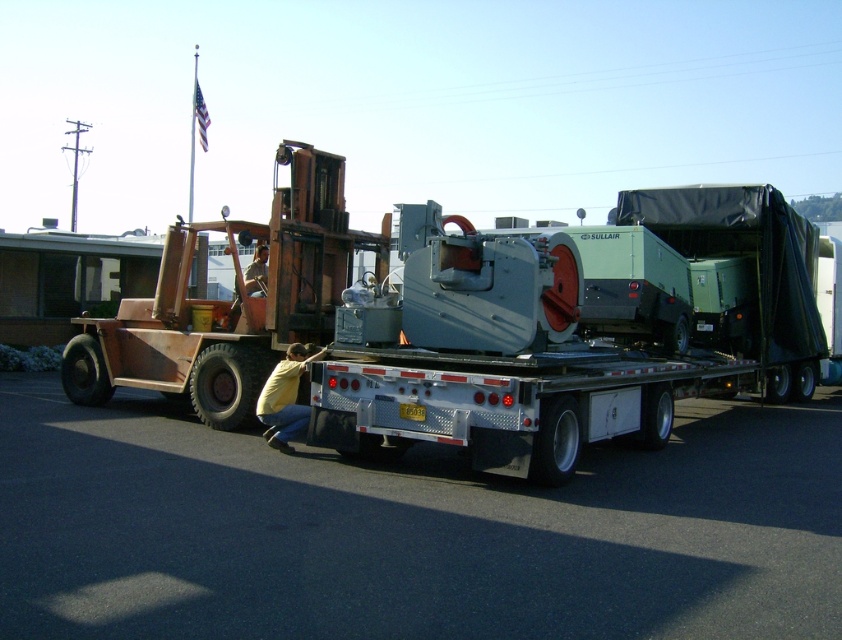
Is rusty metal forklift at center closer to the viewer compared to yellow shirt at lower center?

No, rusty metal forklift at center is behind yellow shirt at lower center.

What do you see at coordinates (228, 301) in the screenshot? I see `rusty metal forklift at center` at bounding box center [228, 301].

Image resolution: width=842 pixels, height=640 pixels. What are the coordinates of `rusty metal forklift at center` in the screenshot? It's located at (228, 301).

Can you confirm if metallic gray machinery at center is shorter than rusty metal forklift at center?

Indeed, metallic gray machinery at center has a lesser height compared to rusty metal forklift at center.

What do you see at coordinates (568, 333) in the screenshot? I see `metallic gray machinery at center` at bounding box center [568, 333].

Where is `metallic gray machinery at center`? Image resolution: width=842 pixels, height=640 pixels. metallic gray machinery at center is located at coordinates (568, 333).

Can you confirm if metallic gray machinery at center is smaller than yellow shirt at lower center?

Actually, metallic gray machinery at center might be larger than yellow shirt at lower center.

Consider the image. Is the position of metallic gray machinery at center more distant than that of yellow shirt at lower center?

No, it is not.

Image resolution: width=842 pixels, height=640 pixels. I want to click on metallic gray machinery at center, so click(568, 333).